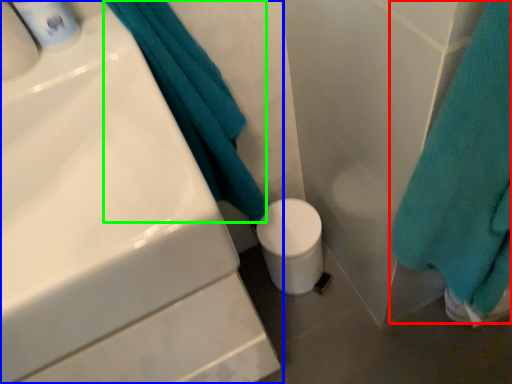
Question: Which object is the farthest from bath towel (highlighted by a red box)? Choose among these: sink (highlighted by a blue box) or bath towel (highlighted by a green box).

Choices:
 (A) sink
 (B) bath towel

Answer: (A)